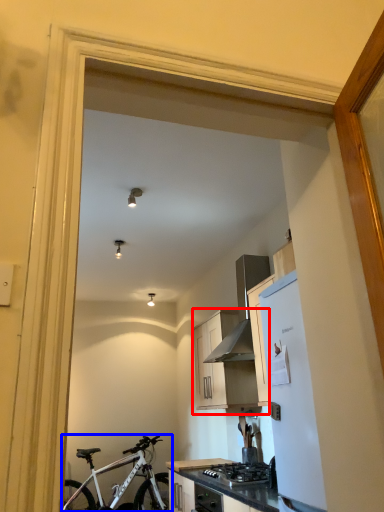
Question: Among these objects, which one is nearest to the camera, cabinetry (highlighted by a red box) or bicycle (highlighted by a blue box)?

Choices:
 (A) cabinetry
 (B) bicycle

Answer: (A)